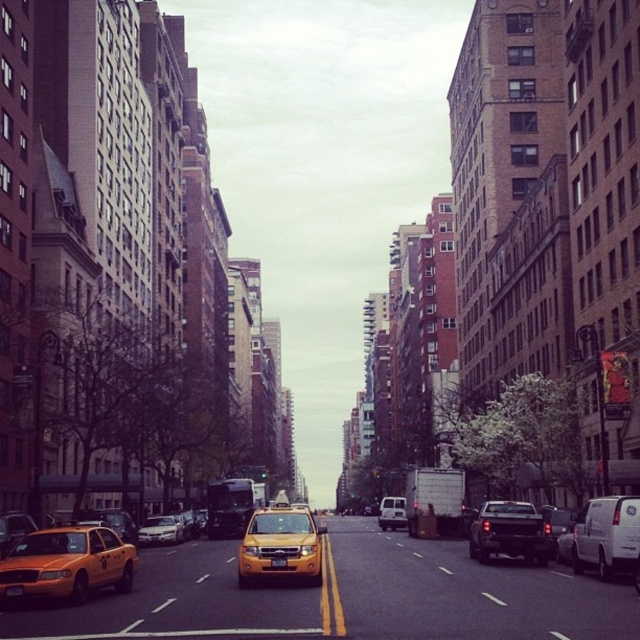
Who is positioned more to the right, white matte van at lower right or silver metallic sedan at center?

white matte van at lower right is more to the right.

Can you confirm if white matte van at lower right is smaller than silver metallic sedan at center?

No, white matte van at lower right is not smaller than silver metallic sedan at center.

Which is behind, point (624, 506) or point (138, 538)?

The point (138, 538) is more distant.

Where is `white matte van at lower right`? Image resolution: width=640 pixels, height=640 pixels. white matte van at lower right is located at coordinates (604, 536).

Does point (250, 540) come farther from viewer compared to point (566, 518)?

That is False.

Between yellow matte taxi at center and matte black truck at center, which one has more height?

yellow matte taxi at center is taller.

Does point (275, 529) come in front of point (572, 522)?

That is True.

Locate an element on the screen. yellow matte taxi at center is located at coordinates (280, 545).

Does yellow matte taxi at center appear on the right side of yellow matte taxi cab at left?

Correct, you'll find yellow matte taxi at center to the right of yellow matte taxi cab at left.

In the scene shown: How distant is yellow matte taxi at center from yellow matte taxi cab at left?

yellow matte taxi at center and yellow matte taxi cab at left are 12.83 meters apart.

Describe the element at coordinates (280, 545) in the screenshot. I see `yellow matte taxi at center` at that location.

This screenshot has width=640, height=640. Identify the location of yellow matte taxi at center. (280, 545).